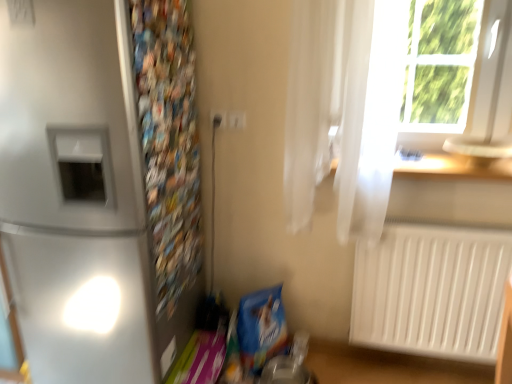
In order to face wooden at upper right, should I rotate leftwards or rightwards?

Rotate right and turn 24.880 degrees.

What do you see at coordinates (454, 167) in the screenshot? I see `wooden at upper right` at bounding box center [454, 167].

Describe the element at coordinates (236, 120) in the screenshot. The height and width of the screenshot is (384, 512). I see `white plastic electric outlet at upper center, marked as the 2th electric outlet in a left-to-right arrangement` at that location.

In order to click on multicolored paper at left in this screenshot , I will do `click(169, 165)`.

The height and width of the screenshot is (384, 512). What do you see at coordinates (440, 64) in the screenshot?
I see `white plastic window frame at upper right` at bounding box center [440, 64].

This screenshot has height=384, width=512. What do you see at coordinates (74, 192) in the screenshot?
I see `satin silver refrigerator at left` at bounding box center [74, 192].

What do you see at coordinates (326, 103) in the screenshot? I see `white sheer curtain at upper right` at bounding box center [326, 103].

The height and width of the screenshot is (384, 512). What are the coordinates of `white plastic radiator at lower right` in the screenshot? It's located at (431, 290).

How many degrees apart are the facing directions of satin silver refrigerator at left and white plastic electric outlet at upper center, which is counted as the first electric outlet, starting from the right?

The angle between the facing direction of satin silver refrigerator at left and the facing direction of white plastic electric outlet at upper center, which is counted as the first electric outlet, starting from the right, is 0.104 degrees.

Considering the positions of points (1, 132) and (242, 120), is point (1, 132) farther from camera compared to point (242, 120)?

No, it is not.

Where is `refrigerator below the white plastic electric outlet at upper center, marked as the 2th electric outlet in a left-to-right arrangement (from the image's perspective)`? This screenshot has width=512, height=384. refrigerator below the white plastic electric outlet at upper center, marked as the 2th electric outlet in a left-to-right arrangement (from the image's perspective) is located at coordinates (74, 192).

Can you confirm if satin silver refrigerator at left is wider than white plastic electric outlet at upper center, which is counted as the first electric outlet, starting from the right?

Correct, the width of satin silver refrigerator at left exceeds that of white plastic electric outlet at upper center, which is counted as the first electric outlet, starting from the right.

Which is correct: multicolored paper at left is inside white plastic electric outlet at center, placed as the second electric outlet when sorted from right to left, or outside of it?

The correct answer is: outside.

Are multicolored paper at left and white plastic electric outlet at center, the 1th electric outlet positioned from the left, far apart?

That's not correct — multicolored paper at left is a little close to white plastic electric outlet at center, the 1th electric outlet positioned from the left.

This screenshot has width=512, height=384. I want to click on bulletin board on the left of the white plastic electric outlet at center, placed as the second electric outlet when sorted from right to left, so click(169, 165).

Is multicolored paper at left to the left or to the right of white plastic electric outlet at center, the 1th electric outlet positioned from the left, in the image?

Based on their positions, multicolored paper at left is located to the left of white plastic electric outlet at center, the 1th electric outlet positioned from the left.

What's the angular difference between white plastic window frame at upper right and wooden at upper right's facing directions?

The angular difference between white plastic window frame at upper right and wooden at upper right is 1.04 degrees.

Considering the sizes of white plastic window frame at upper right and wooden at upper right in the image, is white plastic window frame at upper right wider or thinner than wooden at upper right?

white plastic window frame at upper right is thinner than wooden at upper right.

Which is correct: white plastic window frame at upper right is inside wooden at upper right, or outside of it?

white plastic window frame at upper right is not enclosed by wooden at upper right.

Is white plastic window frame at upper right at the left side of wooden at upper right?

Incorrect, white plastic window frame at upper right is not on the left side of wooden at upper right.

Is wooden at upper right facing towards multicolored paper at left?

No, wooden at upper right does not turn towards multicolored paper at left.

Is wooden at upper right at the right side of multicolored paper at left?

Correct, you'll find wooden at upper right to the right of multicolored paper at left.

Consider the image. From the image's perspective, is multicolored paper at left beneath white sheer curtain at upper right?

Indeed, from the image's perspective, multicolored paper at left is shown beneath white sheer curtain at upper right.

Which is correct: multicolored paper at left is inside white sheer curtain at upper right, or outside of it?

multicolored paper at left lies outside white sheer curtain at upper right.

Which object is further away from the camera taking this photo, satin silver refrigerator at left or white sheer curtain at upper right?

white sheer curtain at upper right is further from the camera.

In terms of height, does satin silver refrigerator at left look taller or shorter compared to white sheer curtain at upper right?

Clearly, satin silver refrigerator at left is taller compared to white sheer curtain at upper right.

From a real-world perspective, between satin silver refrigerator at left and white sheer curtain at upper right, who is vertically higher?

white sheer curtain at upper right.

Is satin silver refrigerator at left oriented away from white sheer curtain at upper right?

No, white sheer curtain at upper right is not at the back of satin silver refrigerator at left.

Between white plastic radiator at lower right and wooden at upper right, which one has larger width?

wooden at upper right.

Which is in front, point (477, 255) or point (474, 169)?

The point (477, 255) is closer.

Is wooden at upper right at the back of white plastic radiator at lower right?

That's not correct — white plastic radiator at lower right is not looking away from wooden at upper right.

Identify the location of refrigerator below the white plastic electric outlet at upper center, marked as the 2th electric outlet in a left-to-right arrangement (from the image's perspective). The image size is (512, 384). (74, 192).

Locate an element on the screen. bulletin board in front of the white plastic electric outlet at center, the 1th electric outlet positioned from the left is located at coordinates (169, 165).

Looking at this image, considering their positions, is white plastic electric outlet at center, the 1th electric outlet positioned from the left, positioned further to white plastic window frame at upper right than multicolored paper at left?

multicolored paper at left is further to white plastic window frame at upper right.

Based on their spatial positions, is white plastic electric outlet at upper center, which is counted as the first electric outlet, starting from the right, or wooden at upper right closer to satin silver refrigerator at left?

Based on the image, white plastic electric outlet at upper center, which is counted as the first electric outlet, starting from the right, appears to be nearer to satin silver refrigerator at left.

Estimate the real-world distances between objects in this image. Which object is closer to multicolored paper at left, satin silver refrigerator at left or white plastic electric outlet at center, the 1th electric outlet positioned from the left?

satin silver refrigerator at left is closer to multicolored paper at left.

When comparing their distances from white sheer curtain at upper right, does wooden at upper right or white plastic electric outlet at center, the 1th electric outlet positioned from the left, seem closer?

wooden at upper right lies closer to white sheer curtain at upper right than the other object.

From the image, which object appears to be nearer to satin silver refrigerator at left, white plastic radiator at lower right or white plastic electric outlet at center, placed as the second electric outlet when sorted from right to left?

Among the two, white plastic electric outlet at center, placed as the second electric outlet when sorted from right to left, is located nearer to satin silver refrigerator at left.

When comparing their distances from satin silver refrigerator at left, does white plastic electric outlet at upper center, which is counted as the first electric outlet, starting from the right, or multicolored paper at left seem closer?

Based on the image, multicolored paper at left appears to be nearer to satin silver refrigerator at left.

Considering their positions, is white plastic electric outlet at center, placed as the second electric outlet when sorted from right to left, positioned further to multicolored paper at left than white sheer curtain at upper right?

Based on the image, white sheer curtain at upper right appears to be further to multicolored paper at left.

From the image, which object appears to be farther from wooden at upper right, white plastic electric outlet at center, placed as the second electric outlet when sorted from right to left, or white plastic electric outlet at upper center, marked as the 2th electric outlet in a left-to-right arrangement?

white plastic electric outlet at center, placed as the second electric outlet when sorted from right to left, lies further to wooden at upper right than the other object.

Where is `bulletin board between satin silver refrigerator at left and white plastic electric outlet at upper center, which is counted as the first electric outlet, starting from the right, in the front-back direction`? The image size is (512, 384). bulletin board between satin silver refrigerator at left and white plastic electric outlet at upper center, which is counted as the first electric outlet, starting from the right, in the front-back direction is located at coordinates (169, 165).

Where is `curtain located between white plastic electric outlet at center, placed as the second electric outlet when sorted from right to left, and wooden at upper right in the left-right direction`? This screenshot has height=384, width=512. curtain located between white plastic electric outlet at center, placed as the second electric outlet when sorted from right to left, and wooden at upper right in the left-right direction is located at coordinates [x=326, y=103].

Image resolution: width=512 pixels, height=384 pixels. I want to click on radiator between satin silver refrigerator at left and wooden at upper right from left to right, so click(x=431, y=290).

The image size is (512, 384). I want to click on bulletin board between satin silver refrigerator at left and white plastic electric outlet at center, the 1th electric outlet positioned from the left, in the front-back direction, so click(x=169, y=165).